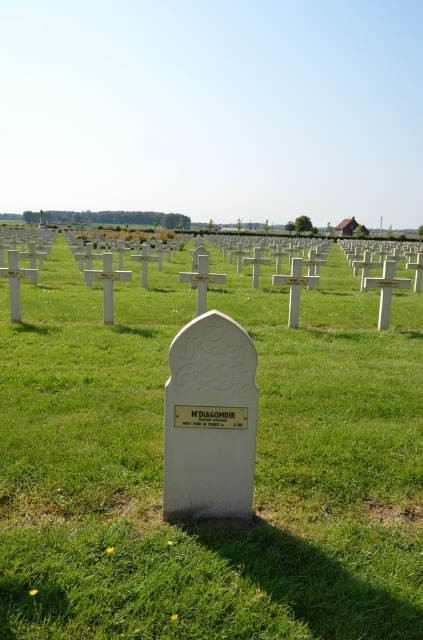
You are visiting the cemetery and want to take a photo of both the white stone cross at center and the white stone gravestone at center. Which object should you focus on first if you want both to be in sharp focus?

The white stone gravestone at center is shorter than the white stone cross at center. To ensure both are in focus, focus on the white stone cross at center since it is taller and will require a greater depth of field.

You are standing at the edge of the cemetery and notice both the white stone cross at center and the white stone gravestone at center. Based on their sizes, which one would appear larger to someone viewing them from your current position?

The white stone cross at center might be wider than the white stone gravestone at center, so it would likely appear larger to someone viewing them from your current position.